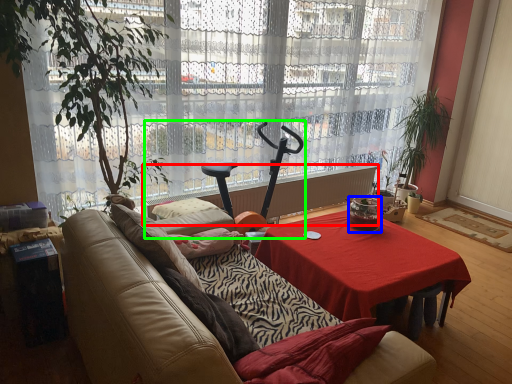
Question: Estimate the real-world distances between objects in this image. Which object is closer to radiator (highlighted by a red box), coffee cup (highlighted by a blue box) or baby carriage (highlighted by a green box)?

Choices:
 (A) coffee cup
 (B) baby carriage

Answer: (B)